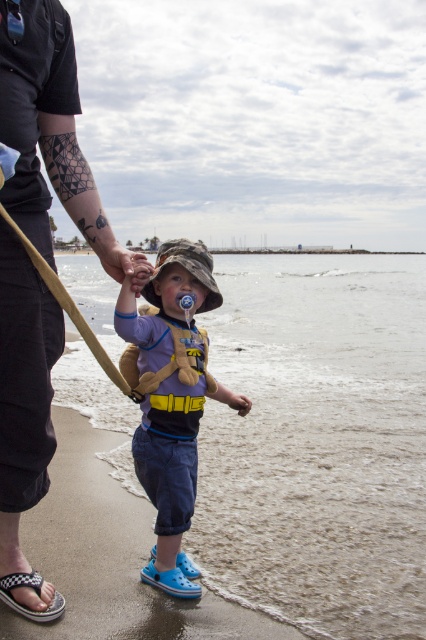
You are a photographer trying to capture a candid shot of the child and adult walking on the beach. The camera you are using has a maximum focus range of 16 inches. Based on the scene, can you focus on both the dark blue jeans at center and the matte blue shorts at center simultaneously?

The dark blue jeans at center is 16.74 inches from matte blue shorts at center. Since the distance between them is greater than the camera maximum focus range of 16 inches, the camera cannot focus on both dark blue jeans at center and matte blue shorts at center at the same time.

You are a photographer trying to capture the child and adult walking on the beach. You notice the dark blue jeans at center and the matte blue shorts at center. Which clothing item is covering the other?

The dark blue jeans at center is positioned over matte blue shorts at center, so the jeans are covering the shorts.

You are standing on the beach and see the dark blue jeans at center and the matte blue shorts at center. Which clothing item is closer to you?

The dark blue jeans at center is closer to the viewer than the matte blue shorts at center.